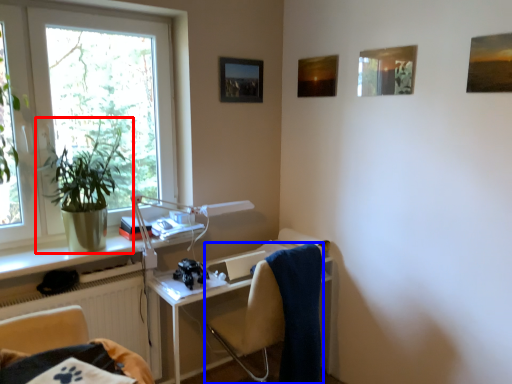
Question: Which point is closer to the camera, houseplant (highlighted by a red box) or chair (highlighted by a blue box)?

Choices:
 (A) houseplant
 (B) chair

Answer: (A)